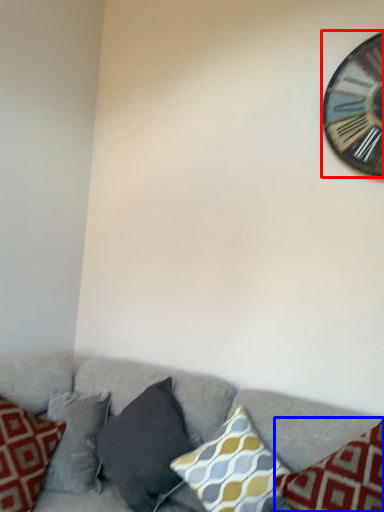
Question: Which object is further to the camera taking this photo, wall clock (highlighted by a red box) or pillow (highlighted by a blue box)?

Choices:
 (A) wall clock
 (B) pillow

Answer: (A)